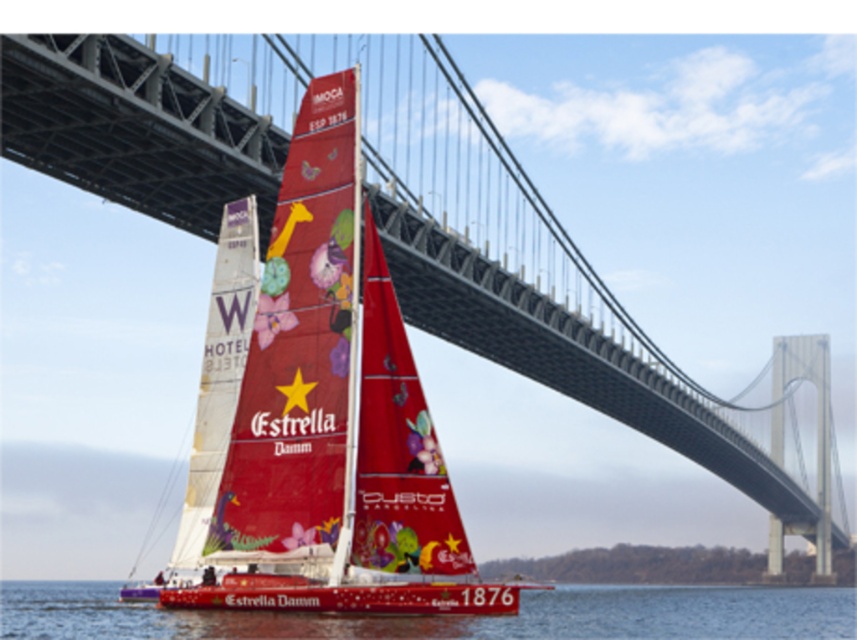
Is transparent water at lower center below matte white sail at center?

Yes, transparent water at lower center is below matte white sail at center.

Does transparent water at lower center have a greater height compared to matte white sail at center?

Incorrect, transparent water at lower center's height is not larger of matte white sail at center's.

Where is `transparent water at lower center`? The width and height of the screenshot is (857, 640). transparent water at lower center is located at coordinates (450, 616).

Which is in front, point (379, 474) or point (177, 579)?

Point (379, 474)

Can you confirm if vivid red sailboat at center is bigger than matte white sail at center?

No, vivid red sailboat at center is not bigger than matte white sail at center.

Is point (304, 310) farther from viewer compared to point (207, 520)?

No, (304, 310) is in front of (207, 520).

Image resolution: width=857 pixels, height=640 pixels. Identify the location of vivid red sailboat at center. (331, 419).

Is vivid red sailboat at center bigger than transparent water at lower center?

No.

Which is in front, point (292, 529) or point (423, 634)?

Point (423, 634)

Identify the location of vivid red sailboat at center. (331, 419).

Where is `vivid red sailboat at center`? This screenshot has height=640, width=857. vivid red sailboat at center is located at coordinates (331, 419).